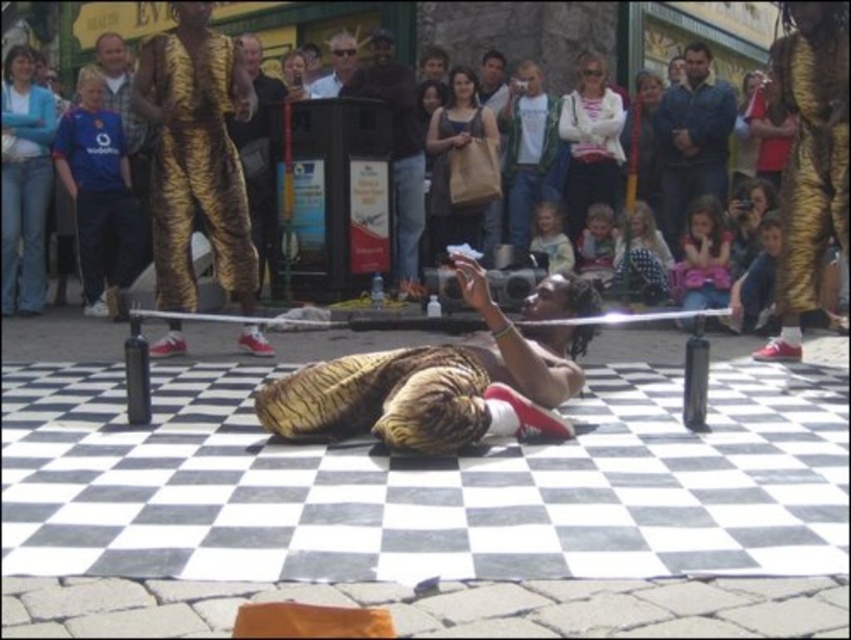
Question: Can you confirm if golden fur coat at center is positioned to the right of matte gold costume at upper center?

Choices:
 (A) no
 (B) yes

Answer: (A)

Question: Does golden fur coat at center come in front of gold metallic jumpsuit at upper left?

Choices:
 (A) no
 (B) yes

Answer: (B)

Question: Which point is farther to the camera?

Choices:
 (A) (567, 60)
 (B) (38, 131)
 (C) (706, 83)
 (D) (513, 132)

Answer: (A)

Question: Among these objects, which one is nearest to the camera?

Choices:
 (A) shiny gold tiger at center
 (B) gold metallic costume at upper right
 (C) pink fabric at upper center

Answer: (A)

Question: Which of these objects is positioned closest to the metallic gold suit at center?

Choices:
 (A) gold metallic costume at upper right
 (B) golden fur coat at center

Answer: (A)

Question: Does shiny gold tiger at center appear over matte brown paper bag at center?

Choices:
 (A) no
 (B) yes

Answer: (A)